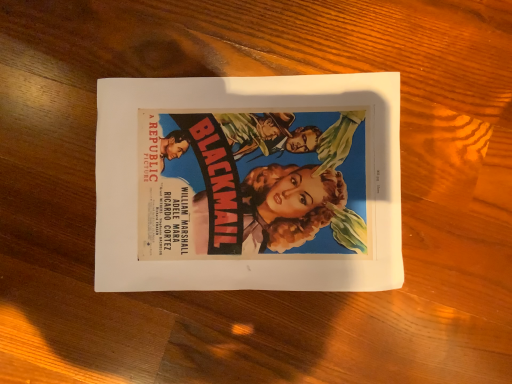
Locate an element on the screen. The width and height of the screenshot is (512, 384). free space above matte paper poster at center (from a real-world perspective) is located at coordinates (244, 187).